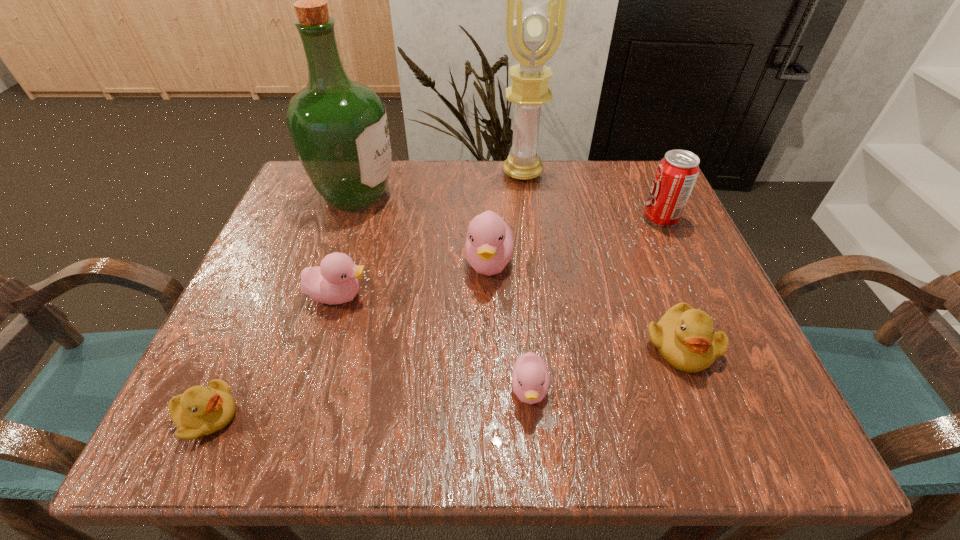
Where is `the nearer yellow duckling`? the nearer yellow duckling is located at coordinates (200, 410).

This screenshot has width=960, height=540. Find the location of `the leftmost duckling`. the leftmost duckling is located at coordinates (200, 410).

I want to click on free spot located on the front-facing side of the liquor, so click(527, 194).

What are the coordinates of `vacant area situated 0.220m on the front-facing side of the award` in the screenshot? It's located at (532, 246).

This screenshot has width=960, height=540. I want to click on free spot located on the left of the soda, so click(510, 219).

Find the location of a particular element. vacant region located 0.170m on the front-facing side of the fourth tallest object is located at coordinates (492, 371).

The height and width of the screenshot is (540, 960). What are the coordinates of `vacant space located on the front-facing side of the leftmost pink duckling` in the screenshot? It's located at (399, 295).

Image resolution: width=960 pixels, height=540 pixels. I want to click on vacant space located on the front-facing side of the right yellow duckling, so click(x=710, y=425).

You are a GUI agent. You are given a task and a screenshot of the screen. Output one action in this format:
    pyautogui.click(x=<x>, y=<y>)
    Task: Click on the vacant region located 0.220m on the front-facing side of the left yellow duckling
    This screenshot has height=540, width=960.
    Given the screenshot: What is the action you would take?
    pyautogui.click(x=388, y=416)

Locate an element on the screen. Image resolution: width=960 pixels, height=540 pixels. liquor positioned at the far edge is located at coordinates (339, 128).